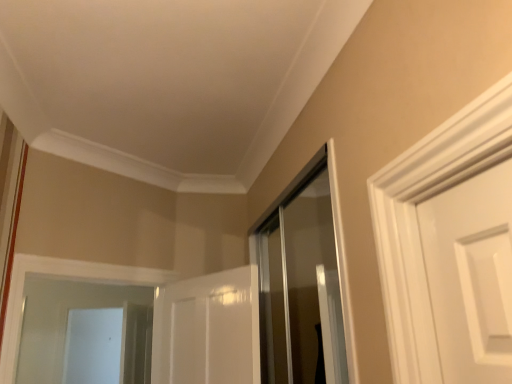
Measure the distance between white glossy screen door at lower left and camera.

white glossy screen door at lower left and camera are 4.40 meters apart from each other.

The width and height of the screenshot is (512, 384). What do you see at coordinates (93, 346) in the screenshot?
I see `white glossy screen door at lower left` at bounding box center [93, 346].

What is the approximate width of white glossy screen door at lower left?

13.76 centimeters.

Where is `white glossy screen door at lower left`? white glossy screen door at lower left is located at coordinates (93, 346).

Measure the distance between clear glass shower door at center and camera.

The depth of clear glass shower door at center is 1.07 meters.

This screenshot has height=384, width=512. What do you see at coordinates (303, 280) in the screenshot?
I see `clear glass shower door at center` at bounding box center [303, 280].

Where is `clear glass shower door at center`? The height and width of the screenshot is (384, 512). clear glass shower door at center is located at coordinates (303, 280).

Locate an element on the screen. This screenshot has height=384, width=512. white glossy screen door at lower left is located at coordinates (93, 346).

Is white glossy screen door at lower left to the left of clear glass shower door at center from the viewer's perspective?

Yes, white glossy screen door at lower left is to the left of clear glass shower door at center.

Looking at this image, is the depth of white glossy screen door at lower left less than that of clear glass shower door at center?

No, the depth of white glossy screen door at lower left is greater than that of clear glass shower door at center.

Does point (92, 383) lie in front of point (336, 281)?

No, (92, 383) is behind (336, 281).

From the image's perspective, which is above, white glossy screen door at lower left or clear glass shower door at center?

clear glass shower door at center appears higher in the image.

From a real-world perspective, which is physically below, white glossy screen door at lower left or clear glass shower door at center?

white glossy screen door at lower left is physically lower.

Considering the sizes of objects white glossy screen door at lower left and clear glass shower door at center in the image provided, who is thinner, white glossy screen door at lower left or clear glass shower door at center?

Thinner between the two is clear glass shower door at center.

Considering the sizes of objects white glossy screen door at lower left and clear glass shower door at center in the image provided, who is shorter, white glossy screen door at lower left or clear glass shower door at center?

clear glass shower door at center.

Considering the sizes of objects white glossy screen door at lower left and clear glass shower door at center in the image provided, who is smaller, white glossy screen door at lower left or clear glass shower door at center?

Smaller between the two is clear glass shower door at center.

Is white glossy screen door at lower left not within clear glass shower door at center?

Yes, white glossy screen door at lower left is outside of clear glass shower door at center.

Is white glossy screen door at lower left positioned far away from clear glass shower door at center?

Yes.

Could you tell me if white glossy screen door at lower left is turned towards clear glass shower door at center?

No, white glossy screen door at lower left is not aimed at clear glass shower door at center.

Where is `screen door that appears below the clear glass shower door at center (from a real-world perspective)`? This screenshot has height=384, width=512. screen door that appears below the clear glass shower door at center (from a real-world perspective) is located at coordinates (93, 346).

Can you confirm if clear glass shower door at center is positioned to the left of white glossy screen door at lower left?

Incorrect, clear glass shower door at center is not on the left side of white glossy screen door at lower left.

In the image, is clear glass shower door at center positioned in front of or behind white glossy screen door at lower left?

clear glass shower door at center is in front of white glossy screen door at lower left.

Does point (338, 324) come closer to viewer compared to point (76, 327)?

Yes.

From the image's perspective, is clear glass shower door at center positioned above or below white glossy screen door at lower left?

clear glass shower door at center is situated higher than white glossy screen door at lower left in the image.

From a real-world perspective, is clear glass shower door at center on top of white glossy screen door at lower left?

Yes, from a real-world perspective, clear glass shower door at center is over white glossy screen door at lower left

Is clear glass shower door at center wider than white glossy screen door at lower left?

Incorrect, the width of clear glass shower door at center does not surpass that of white glossy screen door at lower left.

Looking at this image, is clear glass shower door at center shorter than white glossy screen door at lower left?

Yes, clear glass shower door at center is shorter than white glossy screen door at lower left.

Considering the sizes of clear glass shower door at center and white glossy screen door at lower left in the image, is clear glass shower door at center bigger or smaller than white glossy screen door at lower left?

Clearly, clear glass shower door at center is smaller in size than white glossy screen door at lower left.

Is clear glass shower door at center located outside white glossy screen door at lower left?

Absolutely, clear glass shower door at center is external to white glossy screen door at lower left.

Is clear glass shower door at center not close to white glossy screen door at lower left?

Absolutely, clear glass shower door at center is distant from white glossy screen door at lower left.

Could you tell me if clear glass shower door at center is turned towards white glossy screen door at lower left?

No, clear glass shower door at center is not turned towards white glossy screen door at lower left.

This screenshot has width=512, height=384. I want to click on shower door lying above the white glossy screen door at lower left (from the image's perspective), so pos(303,280).

In order to click on shower door in front of the white glossy screen door at lower left in this screenshot , I will do `click(303, 280)`.

The image size is (512, 384). What are the coordinates of `screen door on the left of the clear glass shower door at center` in the screenshot? It's located at (93, 346).